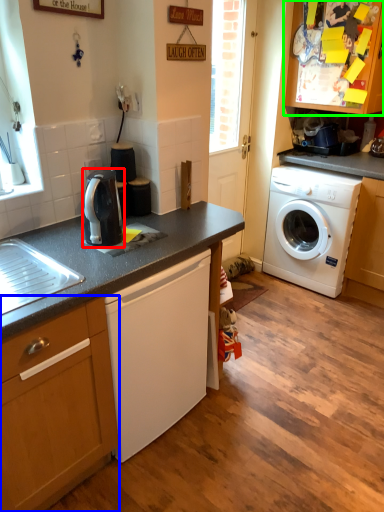
Question: Considering the real-world distances, which object is farthest from kitchen appliance (highlighted by a red box)? cabinetry (highlighted by a blue box) or cabinetry (highlighted by a green box)?

Choices:
 (A) cabinetry
 (B) cabinetry

Answer: (B)